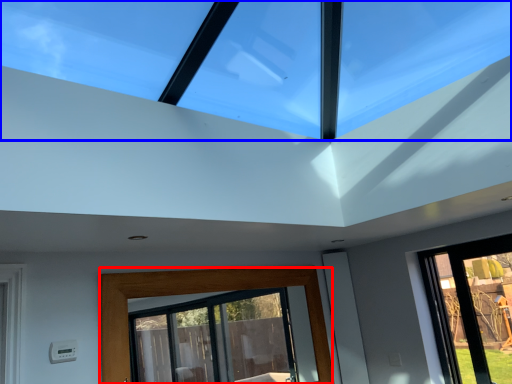
Question: Which object is closer to the camera taking this photo, window (highlighted by a red box) or window (highlighted by a blue box)?

Choices:
 (A) window
 (B) window

Answer: (B)